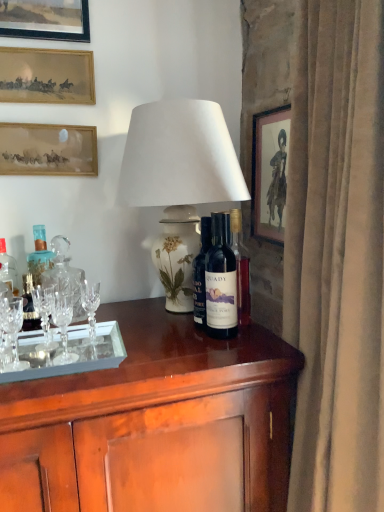
The image size is (384, 512). I want to click on free location above glossy wood desk at center (from a real-world perspective), so click(127, 340).